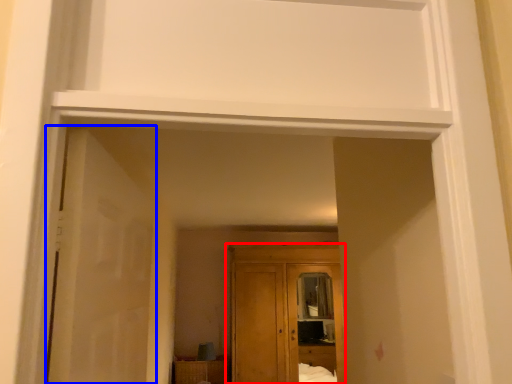
Question: Which of the following is the closest to the observer, cupboard (highlighted by a red box) or door (highlighted by a blue box)?

Choices:
 (A) cupboard
 (B) door

Answer: (B)